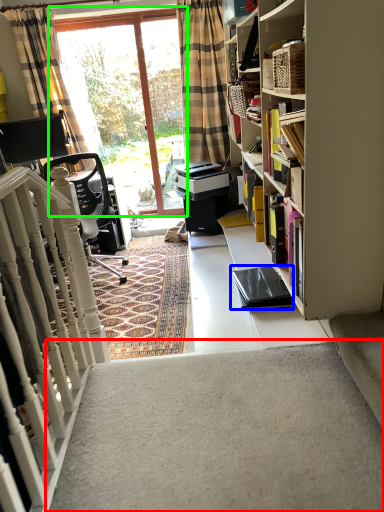
Question: Based on their relative distances, which object is farther from stairwell (highlighted by a red box)? Choose from equipment (highlighted by a blue box) and window (highlighted by a green box).

Choices:
 (A) equipment
 (B) window

Answer: (B)